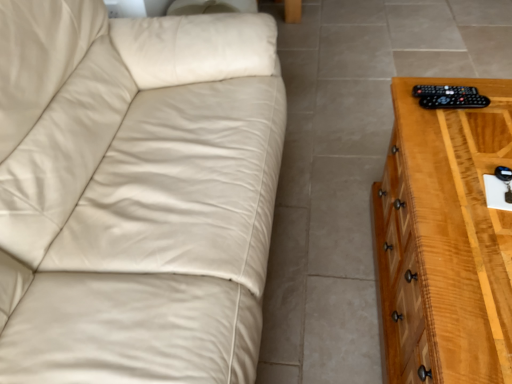
What are the coordinates of `free point in front of black plastic remote at right` in the screenshot? It's located at (460, 139).